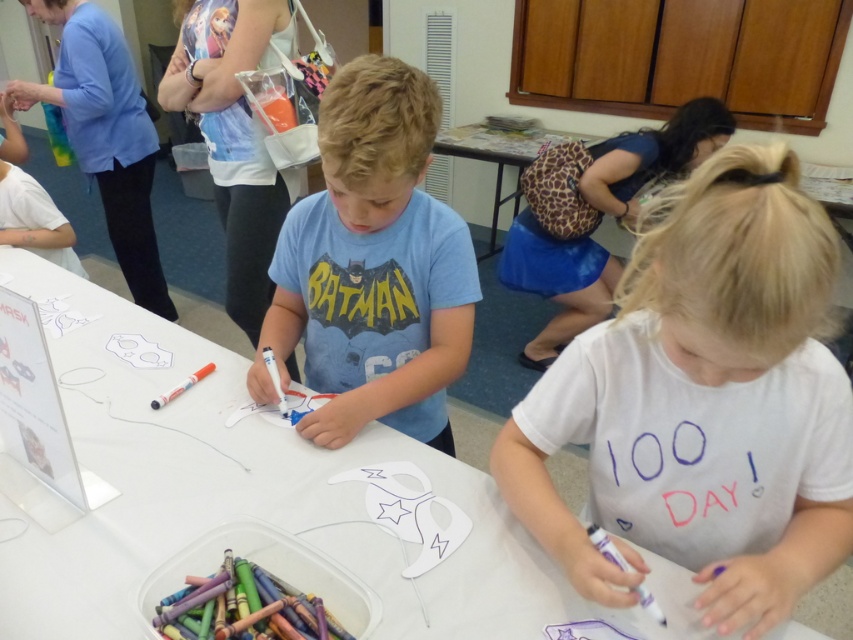
You are a teacher observing the classroom scene. You need to place a new craft kit on the white paper table at center so it can be easily accessed by both children. Considering the position of the orange matte marker at lower left, where should you place the craft kit on the table?

Place the craft kit on the white paper table at center towards the side opposite the orange matte marker at lower left to ensure it is accessible to both children.

You are a teacher observing the classroom scene. You notice the white paper table at center and the orange matte marker at lower left. Which object is positioned to the left of the other?

The white paper table at center is to the left of orange matte marker at lower left.